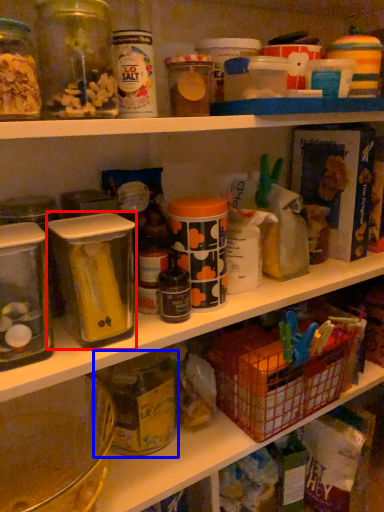
Question: Among these objects, which one is farthest to the camera, carton (highlighted by a red box) or glass jar (highlighted by a blue box)?

Choices:
 (A) carton
 (B) glass jar

Answer: (B)